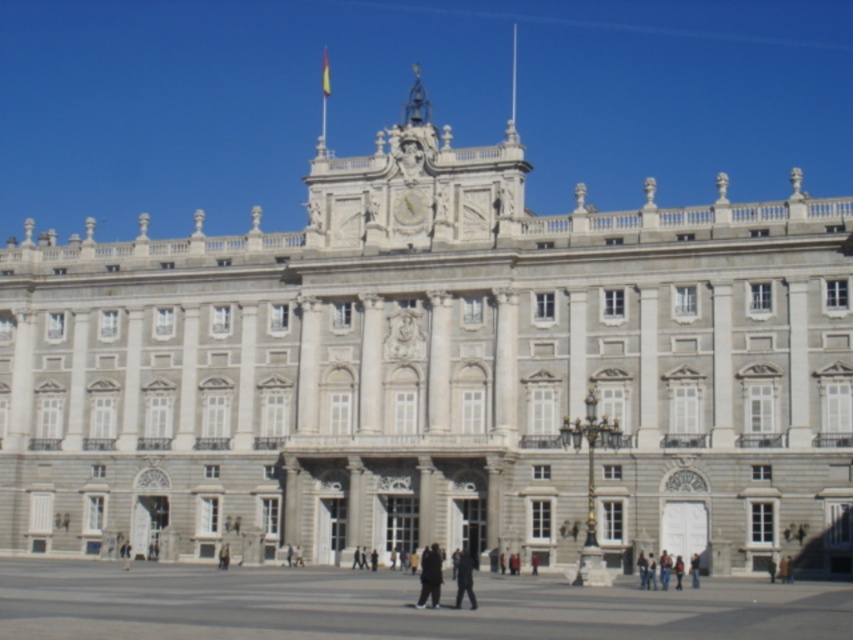
You are a photographer standing in front of the grand historic building. You notice two dark gray items at the center of the image. Which one is taller between the dark gray fabric pants at center and the dark gray uniform at center?

The dark gray fabric pants at center is taller than the dark gray uniform at center.